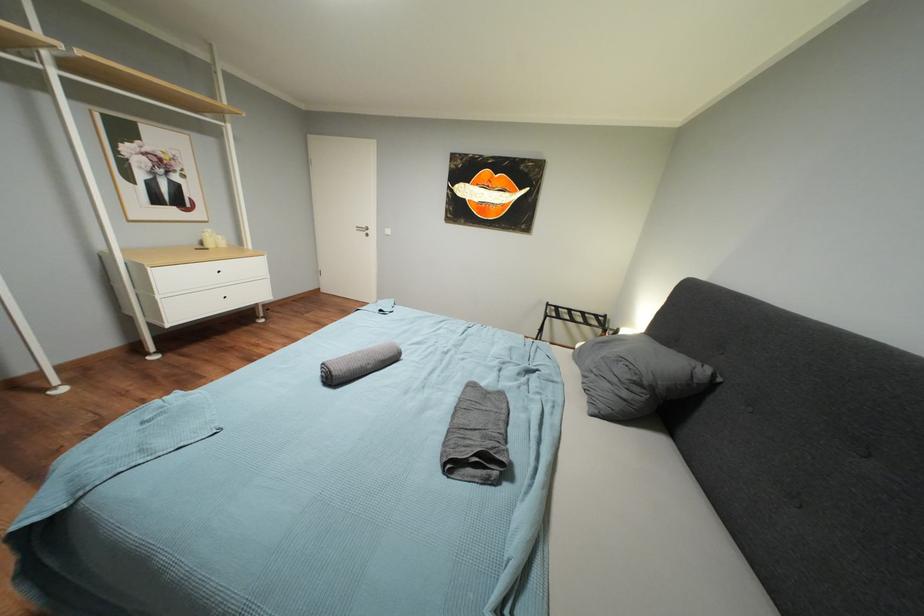
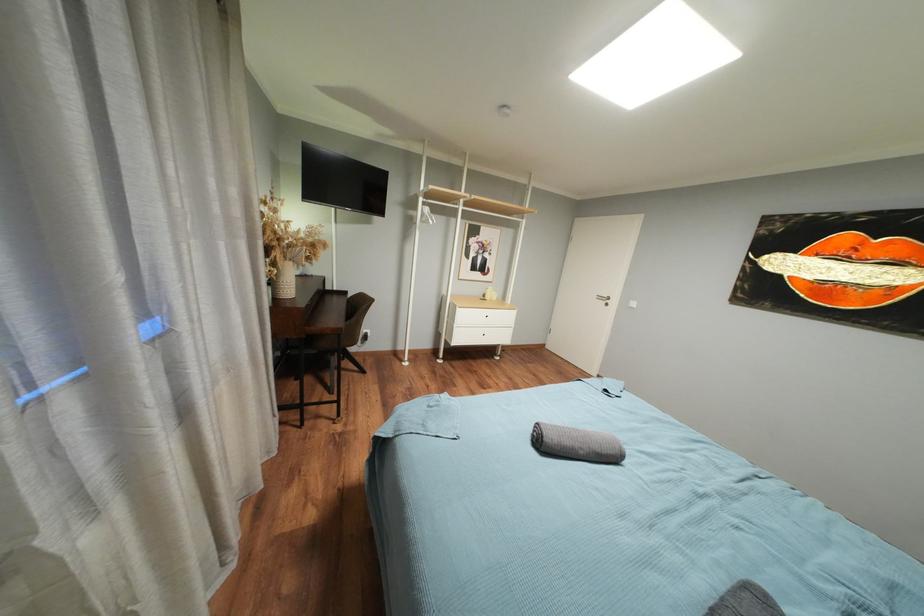
Question: The camera is either moving clockwise (left) or counter-clockwise (right) around the object. The first image is from the beginning of the video and the second image is from the end. Is the camera moving left or right when shooting the video?

Choices:
 (A) Left
 (B) Right

Answer: (B)